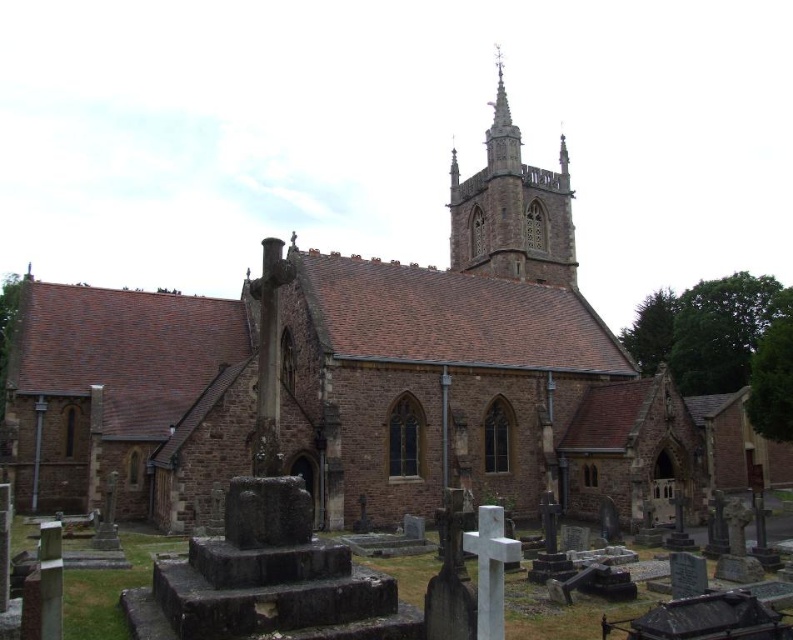
Question: Can you confirm if rusty stone tombstone at lower center is smaller than smooth stone tower at upper center?

Choices:
 (A) no
 (B) yes

Answer: (B)

Question: Does rusty stone tombstone at lower center appear under smooth stone tower at upper center?

Choices:
 (A) no
 (B) yes

Answer: (B)

Question: Which point appears farthest from the camera in this image?

Choices:
 (A) (516, 129)
 (B) (244, 529)

Answer: (A)

Question: Which point appears farthest from the camera in this image?

Choices:
 (A) (500, 531)
 (B) (497, 227)

Answer: (B)

Question: In this image, where is rusty stone tombstone at lower center located relative to smooth stone tower at upper center?

Choices:
 (A) left
 (B) right

Answer: (A)